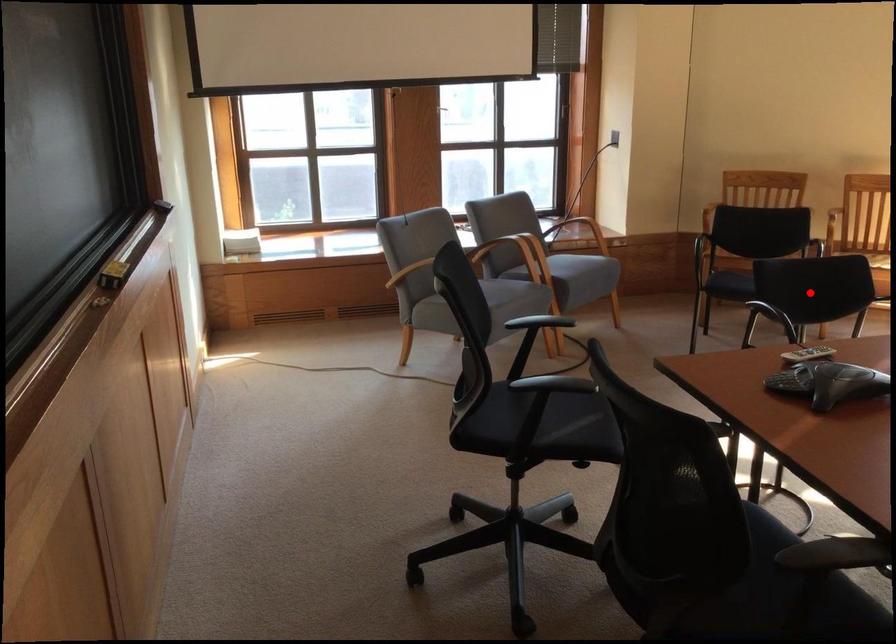
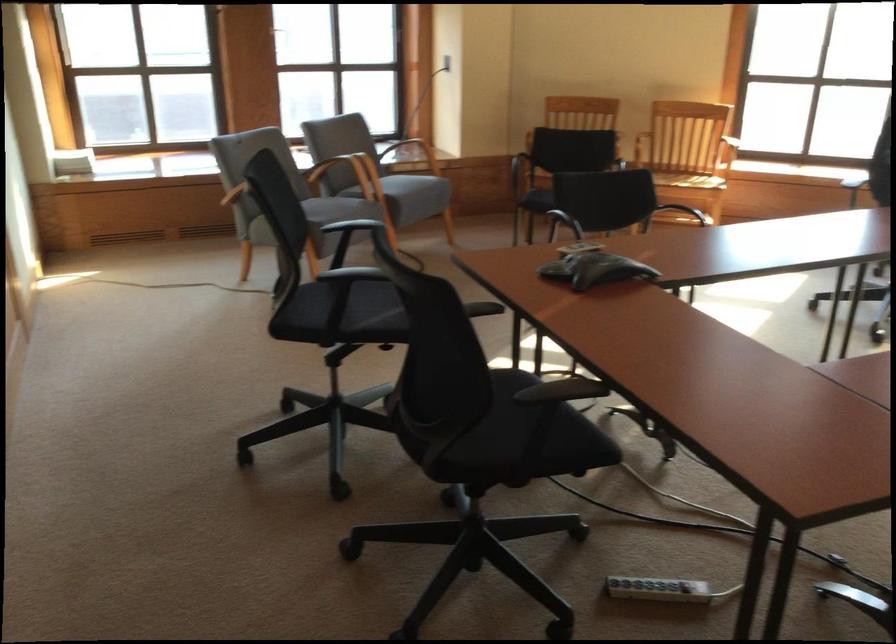
Question: I am providing you with two images of the same scene from different viewpoints. Given a red point in image1, look at the same physical point in image2. Is it:

Choices:
 (A) Closer to the viewpoint
 (B) Farther from the viewpoint

Answer: (B)